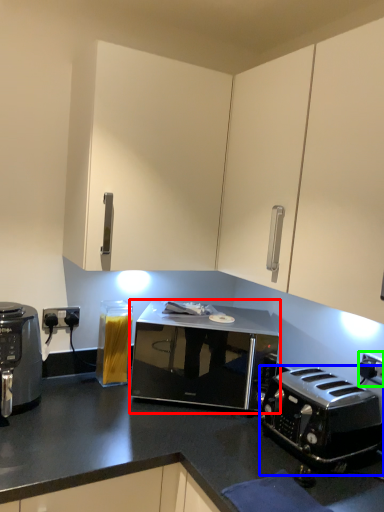
Question: Which object is the farthest from microwave oven (highlighted by a red box)? Choose among these: toaster (highlighted by a blue box) or electric outlet (highlighted by a green box).

Choices:
 (A) toaster
 (B) electric outlet

Answer: (B)